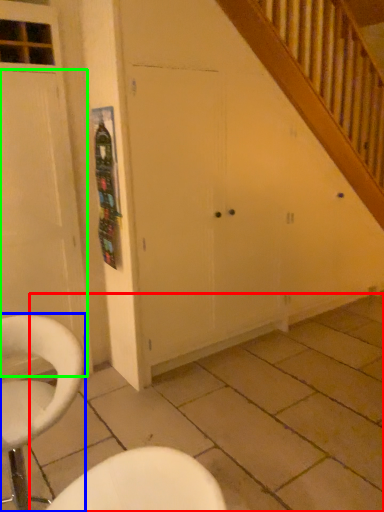
Question: Based on their relative distances, which object is nearer to tile (highlighted by a red box)? Choose from chair (highlighted by a blue box) and door (highlighted by a green box).

Choices:
 (A) chair
 (B) door

Answer: (A)